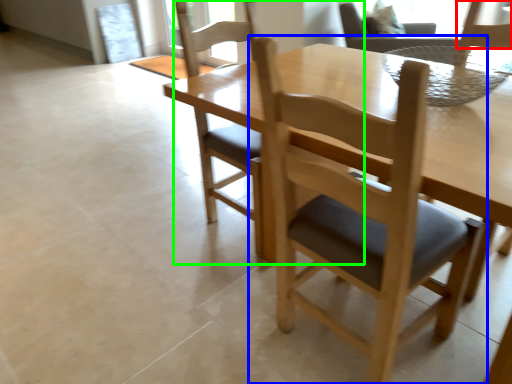
Question: Estimate the real-world distances between objects in this image. Which object is farther from chair (highlighted by a red box), chair (highlighted by a blue box) or chair (highlighted by a green box)?

Choices:
 (A) chair
 (B) chair

Answer: (B)